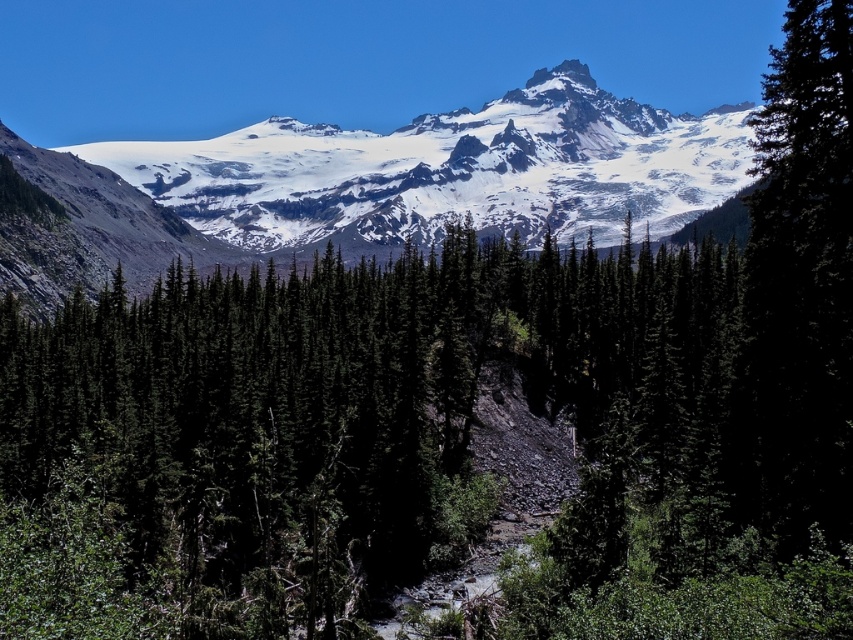
You are a hiker planning to take a photo of the green matte tree at right and the white rocky peak at upper center from a spot that is equidistant to both. Is this possible given their current positions?

The green matte tree at right and the white rocky peak at upper center are 172.16 meters apart. To be equidistant, you would need to stand exactly halfway between them, which is 86.08 meters from each. This is possible as long as there is a clear path to that midpoint.

You are a hiker planning a route through the landscape. You see the green matte tree at right and the white rocky peak at upper center. Which object is located to the right of the other?

The green matte tree at right is positioned on the right side of white rocky peak at upper center, so the green matte tree at right is to the right of the white rocky peak at upper center.

You are standing at the point marked as point (370, 186) in the image. What is the most prominent feature visible from this location?

The most prominent feature visible from point (370, 186) is the snowy granite mountain range at upper center, which is located at that exact point.